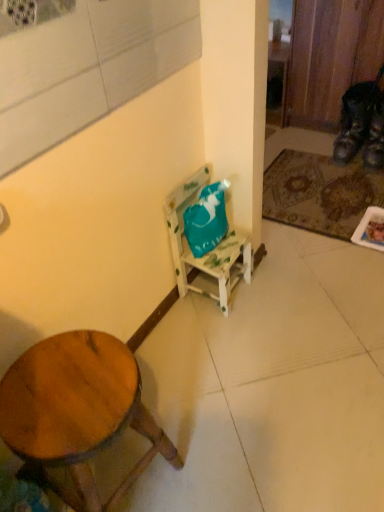
Where is `vacant area located to the right-hand side of teal fabric bag at center`? The width and height of the screenshot is (384, 512). vacant area located to the right-hand side of teal fabric bag at center is located at coordinates (276, 291).